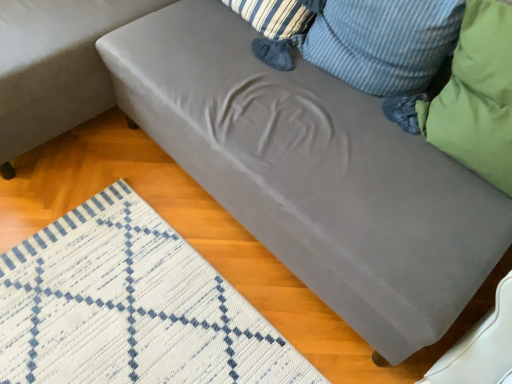
Identify the location of satin gray couch at lower right. Image resolution: width=512 pixels, height=384 pixels. (55, 67).

The height and width of the screenshot is (384, 512). Describe the element at coordinates (382, 41) in the screenshot. I see `green fabric pillow at upper right, acting as the 1th pillow starting from the left` at that location.

Find the location of a particular element. This screenshot has width=512, height=384. satin gray couch at lower right is located at coordinates (55, 67).

From a real-world perspective, is satin gray couch at lower right physically located above or below green fabric pillow at right, which ranks as the second pillow in left-to-right order?

In terms of real-world spatial position, satin gray couch at lower right is below green fabric pillow at right, which ranks as the second pillow in left-to-right order.

Can you tell me how much satin gray couch at lower right and green fabric pillow at right, which is counted as the 1th pillow, starting from the right, differ in facing direction?

There is a 87.3-degree angle between the facing directions of satin gray couch at lower right and green fabric pillow at right, which is counted as the 1th pillow, starting from the right.

At what (x,y) coordinates should I click in order to perform the action: click on studio couch on the left side of green fabric pillow at right, which is counted as the 1th pillow, starting from the right. Please return your answer as a coordinate pair (x, y). The image size is (512, 384). Looking at the image, I should click on (55, 67).

Considering the relative sizes of satin gray couch at lower right and green fabric pillow at right, which is counted as the 1th pillow, starting from the right, in the image provided, is satin gray couch at lower right thinner than green fabric pillow at right, which is counted as the 1th pillow, starting from the right,?

No.

Is green fabric pillow at right, which is counted as the 1th pillow, starting from the right, turned away from green fabric pillow at upper right, acting as the 1th pillow starting from the left?

green fabric pillow at right, which is counted as the 1th pillow, starting from the right, does not have its back to green fabric pillow at upper right, acting as the 1th pillow starting from the left.

Considering the relative sizes of green fabric pillow at right, which is counted as the 1th pillow, starting from the right, and green fabric pillow at upper right, acting as the 1th pillow starting from the left, in the image provided, is green fabric pillow at right, which is counted as the 1th pillow, starting from the right, bigger than green fabric pillow at upper right, acting as the 1th pillow starting from the left,?

Yes.

In the scene shown: Is green fabric pillow at right, which ranks as the second pillow in left-to-right order, at the right side of green fabric pillow at upper right, positioned as the second pillow in right-to-left order?

Indeed, green fabric pillow at right, which ranks as the second pillow in left-to-right order, is positioned on the right side of green fabric pillow at upper right, positioned as the second pillow in right-to-left order.

Looking at this image, from the image's perspective, which one is positioned higher, green fabric pillow at upper right, positioned as the second pillow in right-to-left order, or satin gray couch at lower right?

satin gray couch at lower right, from the image's perspective.

The width and height of the screenshot is (512, 384). I want to click on the 1st pillow in front when counting from the satin gray couch at lower right, so click(382, 41).

Which is more to the left, green fabric pillow at upper right, acting as the 1th pillow starting from the left, or satin gray couch at lower right?

From the viewer's perspective, satin gray couch at lower right appears more on the left side.

Looking at this image, from a real-world perspective, is green fabric pillow at upper right, acting as the 1th pillow starting from the left, positioned above or below satin gray couch at lower right?

green fabric pillow at upper right, acting as the 1th pillow starting from the left, is situated higher than satin gray couch at lower right in the real world.

Is green fabric pillow at upper right, positioned as the second pillow in right-to-left order, situated inside green fabric pillow at right, which ranks as the second pillow in left-to-right order, or outside?

green fabric pillow at upper right, positioned as the second pillow in right-to-left order, exists outside the volume of green fabric pillow at right, which ranks as the second pillow in left-to-right order.

Can you tell me how much green fabric pillow at upper right, positioned as the second pillow in right-to-left order, and green fabric pillow at right, which is counted as the 1th pillow, starting from the right, differ in facing direction?

They differ by 2.68 degrees in their facing directions.

Is green fabric pillow at upper right, positioned as the second pillow in right-to-left order, wider or thinner than green fabric pillow at right, which is counted as the 1th pillow, starting from the right?

Considering their sizes, green fabric pillow at upper right, positioned as the second pillow in right-to-left order, looks slimmer than green fabric pillow at right, which is counted as the 1th pillow, starting from the right.

From the image's perspective, which one is positioned lower, green fabric pillow at upper right, acting as the 1th pillow starting from the left, or green fabric pillow at right, which ranks as the second pillow in left-to-right order?

green fabric pillow at right, which ranks as the second pillow in left-to-right order.

From the image's perspective, is satin gray couch at lower right on green fabric pillow at upper right, positioned as the second pillow in right-to-left order?

Indeed, from the image's perspective, satin gray couch at lower right is shown above green fabric pillow at upper right, positioned as the second pillow in right-to-left order.

Considering the relative positions of satin gray couch at lower right and green fabric pillow at upper right, positioned as the second pillow in right-to-left order, in the image provided, is satin gray couch at lower right in front of green fabric pillow at upper right, positioned as the second pillow in right-to-left order,?

No, satin gray couch at lower right is further to the viewer.

Considering the relative positions of satin gray couch at lower right and green fabric pillow at upper right, positioned as the second pillow in right-to-left order, in the image provided, is satin gray couch at lower right to the left of green fabric pillow at upper right, positioned as the second pillow in right-to-left order, from the viewer's perspective?

Correct, you'll find satin gray couch at lower right to the left of green fabric pillow at upper right, positioned as the second pillow in right-to-left order.

Between satin gray couch at lower right and green fabric pillow at upper right, acting as the 1th pillow starting from the left, which one has larger width?

Wider between the two is satin gray couch at lower right.

Is green fabric pillow at right, which ranks as the second pillow in left-to-right order, smaller than satin gray couch at lower right?

Yes, green fabric pillow at right, which ranks as the second pillow in left-to-right order, is smaller than satin gray couch at lower right.

Is green fabric pillow at right, which is counted as the 1th pillow, starting from the right, completely or partially outside of satin gray couch at lower right?

Yes, green fabric pillow at right, which is counted as the 1th pillow, starting from the right, is located beyond the bounds of satin gray couch at lower right.

From a real-world perspective, which is physically above, green fabric pillow at right, which is counted as the 1th pillow, starting from the right, or satin gray couch at lower right?

In real-world perspective, green fabric pillow at right, which is counted as the 1th pillow, starting from the right, is above.

Considering the sizes of objects green fabric pillow at right, which ranks as the second pillow in left-to-right order, and satin gray couch at lower right in the image provided, who is wider, green fabric pillow at right, which ranks as the second pillow in left-to-right order, or satin gray couch at lower right?

satin gray couch at lower right is wider.

This screenshot has height=384, width=512. I want to click on studio couch located above the green fabric pillow at right, which is counted as the 1th pillow, starting from the right (from the image's perspective), so click(x=55, y=67).

In order to click on pillow on the right of the green fabric pillow at upper right, positioned as the second pillow in right-to-left order in this screenshot , I will do `click(477, 96)`.

When comparing their distances from green fabric pillow at right, which is counted as the 1th pillow, starting from the right, does green fabric pillow at upper right, positioned as the second pillow in right-to-left order, or satin gray couch at lower right seem closer?

green fabric pillow at upper right, positioned as the second pillow in right-to-left order, lies closer to green fabric pillow at right, which is counted as the 1th pillow, starting from the right, than the other object.

Looking at the image, which one is located closer to satin gray couch at lower right, green fabric pillow at upper right, acting as the 1th pillow starting from the left, or green fabric pillow at right, which is counted as the 1th pillow, starting from the right?

green fabric pillow at upper right, acting as the 1th pillow starting from the left.

Based on their spatial positions, is satin gray couch at lower right or green fabric pillow at right, which ranks as the second pillow in left-to-right order, closer to green fabric pillow at upper right, acting as the 1th pillow starting from the left?

green fabric pillow at right, which ranks as the second pillow in left-to-right order, lies closer to green fabric pillow at upper right, acting as the 1th pillow starting from the left, than the other object.

Looking at this image, estimate the real-world distances between objects in this image. Which object is further from satin gray couch at lower right, green fabric pillow at right, which is counted as the 1th pillow, starting from the right, or green fabric pillow at upper right, positioned as the second pillow in right-to-left order?

Among the two, green fabric pillow at right, which is counted as the 1th pillow, starting from the right, is located further to satin gray couch at lower right.

From the image, which object appears to be farther from green fabric pillow at upper right, acting as the 1th pillow starting from the left, green fabric pillow at right, which ranks as the second pillow in left-to-right order, or satin gray couch at lower right?

The object further to green fabric pillow at upper right, acting as the 1th pillow starting from the left, is satin gray couch at lower right.

Considering their positions, is satin gray couch at lower right positioned closer to green fabric pillow at right, which ranks as the second pillow in left-to-right order, than green fabric pillow at upper right, acting as the 1th pillow starting from the left?

green fabric pillow at upper right, acting as the 1th pillow starting from the left, lies closer to green fabric pillow at right, which ranks as the second pillow in left-to-right order, than the other object.

Where is `pillow between satin gray couch at lower right and green fabric pillow at right, which is counted as the 1th pillow, starting from the right, from left to right`? The image size is (512, 384). pillow between satin gray couch at lower right and green fabric pillow at right, which is counted as the 1th pillow, starting from the right, from left to right is located at coordinates (382, 41).